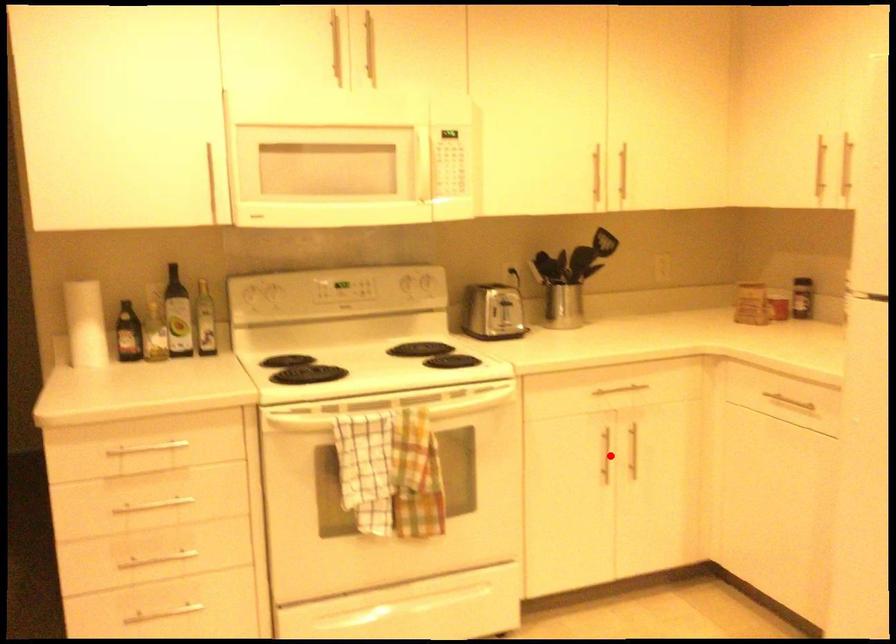
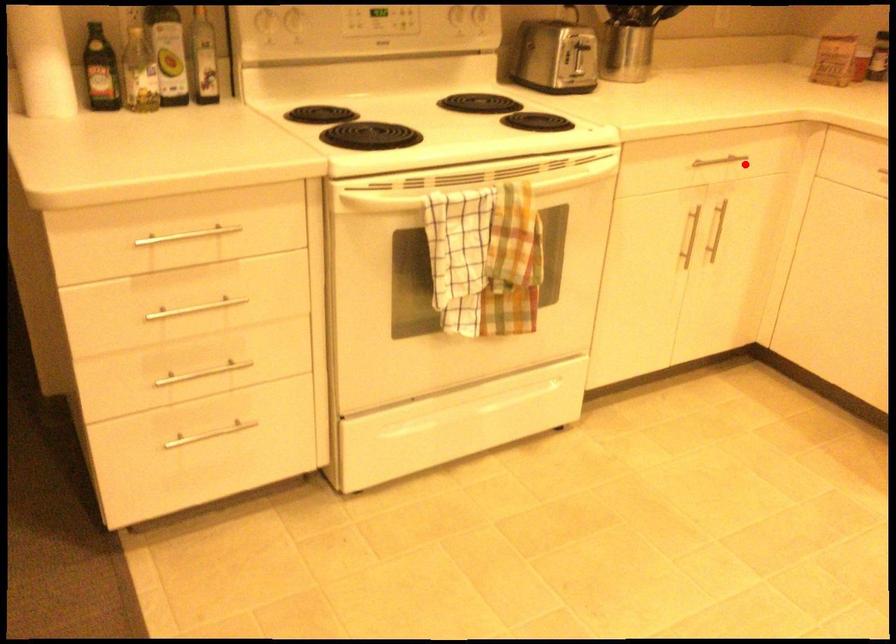
I am providing you with two images of the same scene from different viewpoints. A red point is marked on the first image and another point is marked on the second image. Does the point marked in image1 correspond to the same location as the one in image2?

No